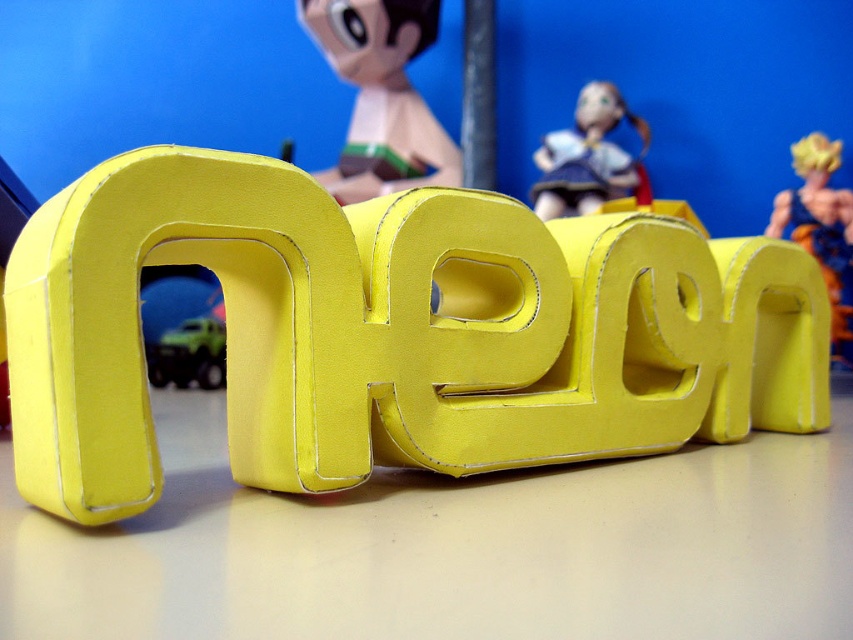
You are standing in front of the yellow, three dimensional word NEON displayed in the foreground. There is a point at coordinates (392, 332). What object is located at that point?

The yellow cardboard letter at center is located at point (392, 332).

You are setting up a display and need to arrange the yellow cardboard letter at center and the matte green plastic toy truck at lower left. If you want to place them side by side without overlapping, which object should be positioned first to ensure there is enough space?

The yellow cardboard letter at center should be positioned first since it is wider than the matte green plastic toy truck at lower left, ensuring there is enough space between them when placed side by side.